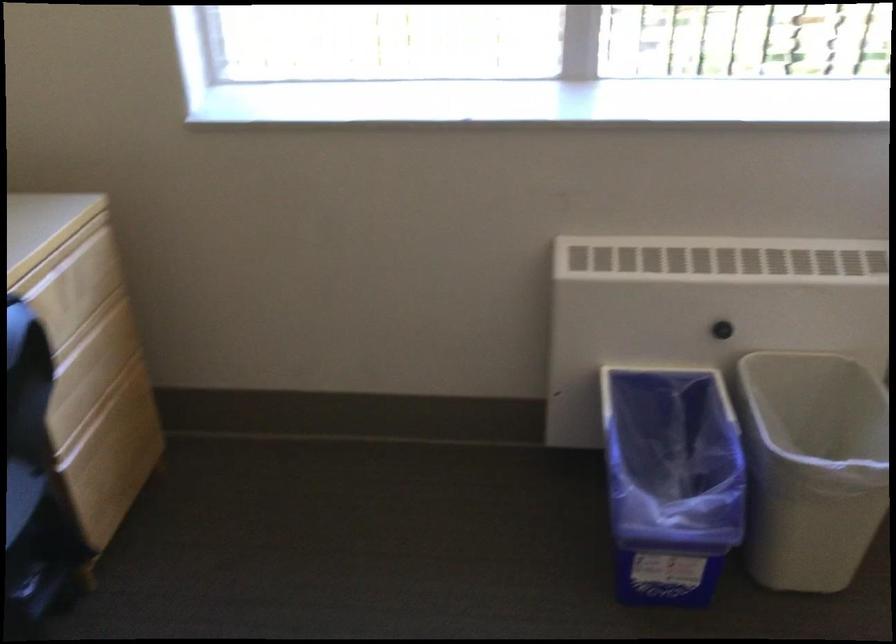
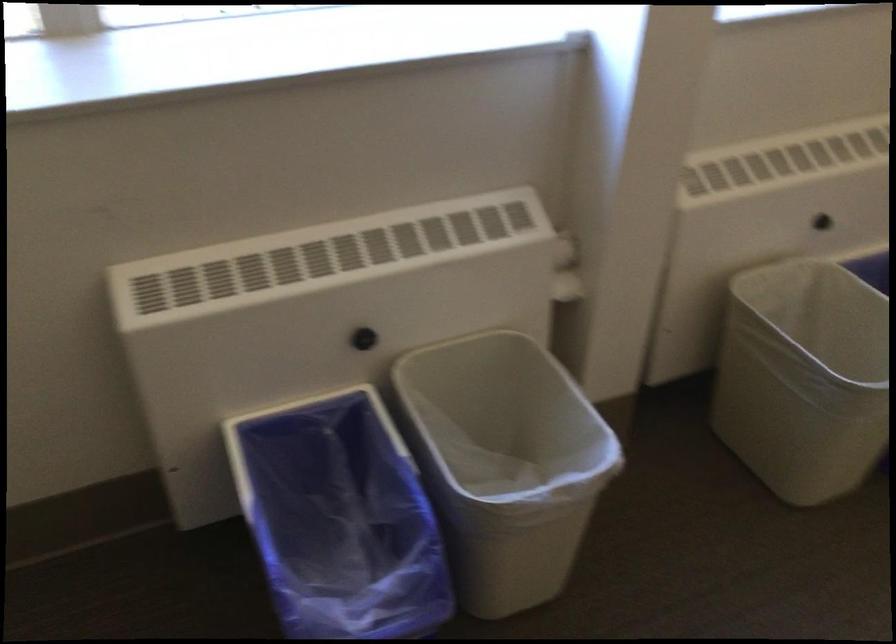
The point at (x=661, y=462) is marked in the first image. Where is the corresponding point in the second image?

(339, 518)